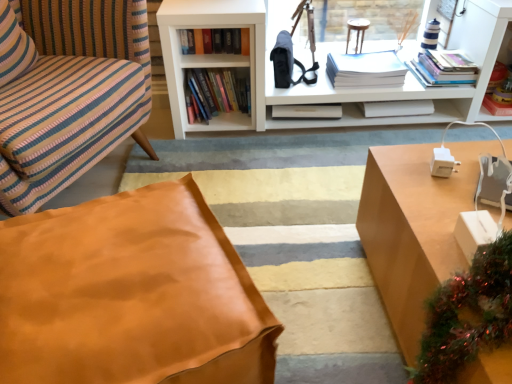
Question: From the image's perspective, is striped fabric pillow at left beneath white matte book at center, marked as the second book in a right-to-left arrangement?

Choices:
 (A) yes
 (B) no

Answer: (B)

Question: Does striped fabric pillow at left have a greater height compared to white matte book at center, marked as the second book in a right-to-left arrangement?

Choices:
 (A) no
 (B) yes

Answer: (B)

Question: Considering the relative sizes of striped fabric pillow at left and white matte book at center, the fourth book from the left, in the image provided, is striped fabric pillow at left shorter than white matte book at center, the fourth book from the left,?

Choices:
 (A) no
 (B) yes

Answer: (A)

Question: Considering the relative positions of striped fabric pillow at left and white matte book at center, marked as the second book in a right-to-left arrangement, in the image provided, is striped fabric pillow at left to the right of white matte book at center, marked as the second book in a right-to-left arrangement, from the viewer's perspective?

Choices:
 (A) no
 (B) yes

Answer: (A)

Question: Considering the relative sizes of striped fabric pillow at left and white matte book at center, the fourth book from the left, in the image provided, is striped fabric pillow at left bigger than white matte book at center, the fourth book from the left,?

Choices:
 (A) no
 (B) yes

Answer: (B)

Question: Is striped fabric pillow at left next to white matte book at center, the fourth book from the left?

Choices:
 (A) yes
 (B) no

Answer: (B)

Question: Does hardcover book at upper center, which appears as the first book when viewed from the left, have a larger size compared to striped fabric pillow at left?

Choices:
 (A) yes
 (B) no

Answer: (B)

Question: From a real-world perspective, does hardcover book at upper center, marked as the 5th book in a right-to-left arrangement, stand above striped fabric pillow at left?

Choices:
 (A) no
 (B) yes

Answer: (A)

Question: Is hardcover book at upper center, which appears as the first book when viewed from the left, placed right next to striped fabric pillow at left?

Choices:
 (A) no
 (B) yes

Answer: (A)

Question: Is hardcover book at upper center, marked as the 5th book in a right-to-left arrangement, oriented away from striped fabric pillow at left?

Choices:
 (A) no
 (B) yes

Answer: (A)

Question: Can striped fabric pillow at left be found inside hardcover book at upper center, marked as the 5th book in a right-to-left arrangement?

Choices:
 (A) no
 (B) yes

Answer: (A)

Question: From the image's perspective, would you say hardcover book at upper center, which appears as the first book when viewed from the left, is positioned over striped fabric pillow at left?

Choices:
 (A) no
 (B) yes

Answer: (B)

Question: Considering the relative sizes of striped fabric pillow at left and hardcover books at upper right, placed as the 1th book when sorted from right to left, in the image provided, is striped fabric pillow at left shorter than hardcover books at upper right, placed as the 1th book when sorted from right to left,?

Choices:
 (A) no
 (B) yes

Answer: (A)